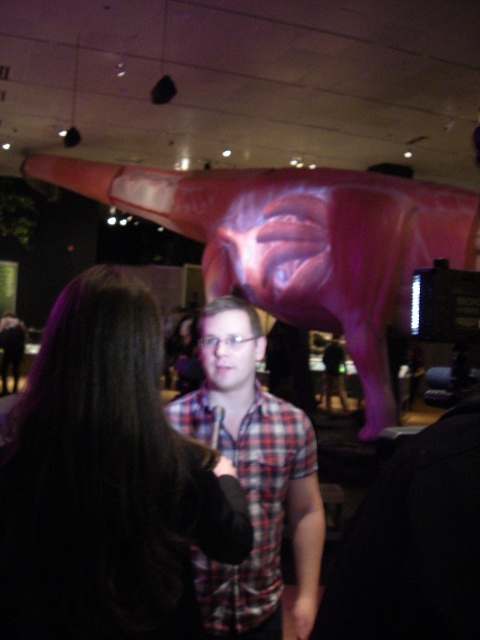
Question: Can you confirm if glossy pink statue at upper center is smaller than plaid shirt at center?

Choices:
 (A) yes
 (B) no

Answer: (B)

Question: Which of these objects is positioned closest to the plaid shirt at center?

Choices:
 (A) dark brown hair at center
 (B) glossy pink statue at upper center

Answer: (A)

Question: Can you confirm if dark brown hair at center is positioned to the right of glossy pink statue at upper center?

Choices:
 (A) yes
 (B) no

Answer: (A)

Question: Does dark brown hair at center have a greater width compared to plaid shirt at center?

Choices:
 (A) yes
 (B) no

Answer: (B)

Question: Which point appears farthest from the camera in this image?

Choices:
 (A) (274, 582)
 (B) (37, 448)

Answer: (A)

Question: Which object is closer to the camera taking this photo?

Choices:
 (A) glossy pink statue at upper center
 (B) plaid shirt at center
 (C) dark brown hair at center

Answer: (C)